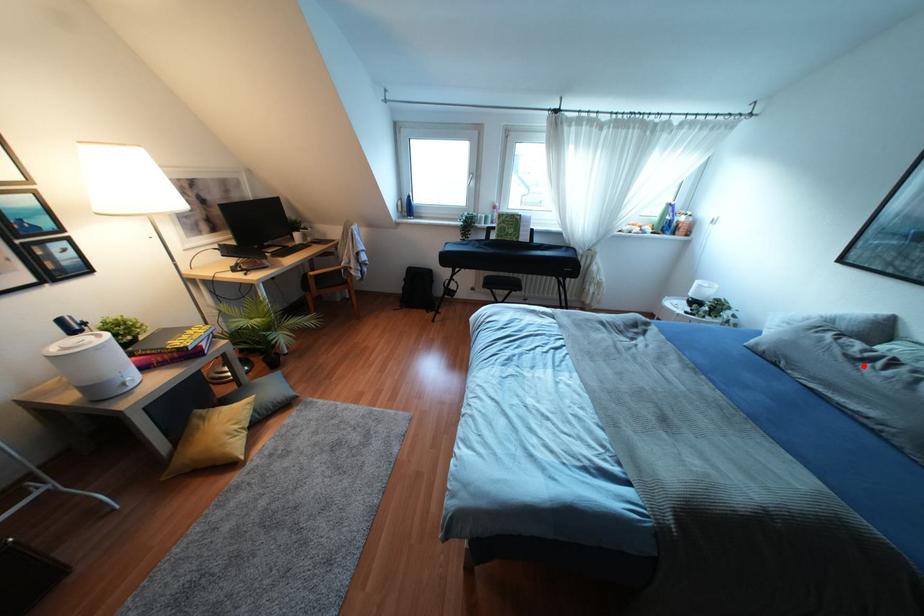
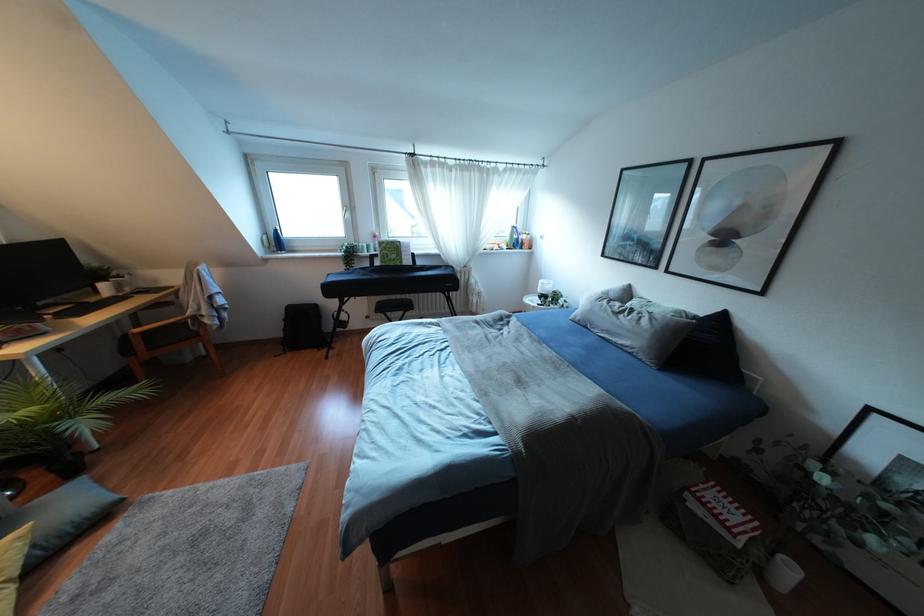
Question: I am providing you with two images of the same scene from different viewpoints. Given a red point in image1, look at the same physical point in image2. Is it:

Choices:
 (A) Closer to the viewpoint
 (B) Farther from the viewpoint

Answer: (A)